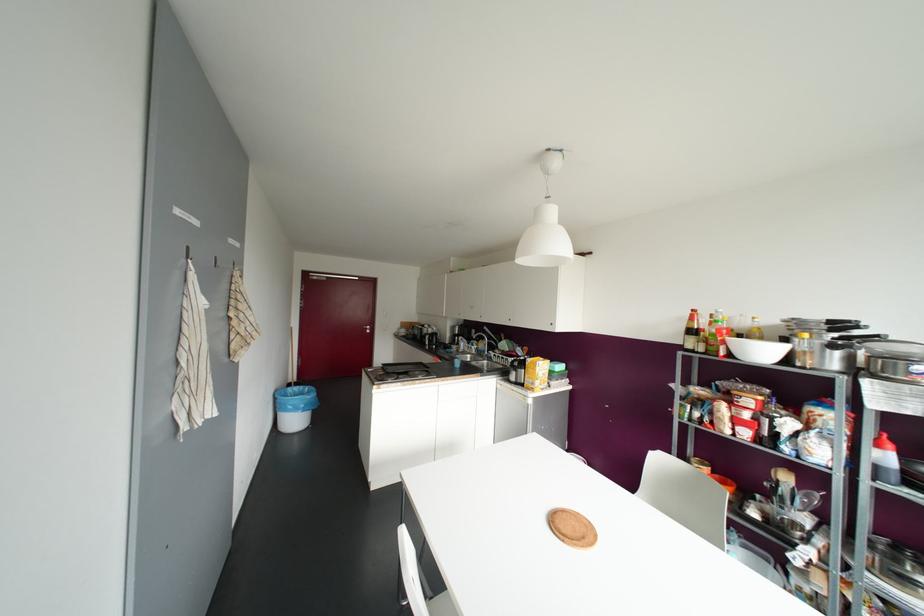
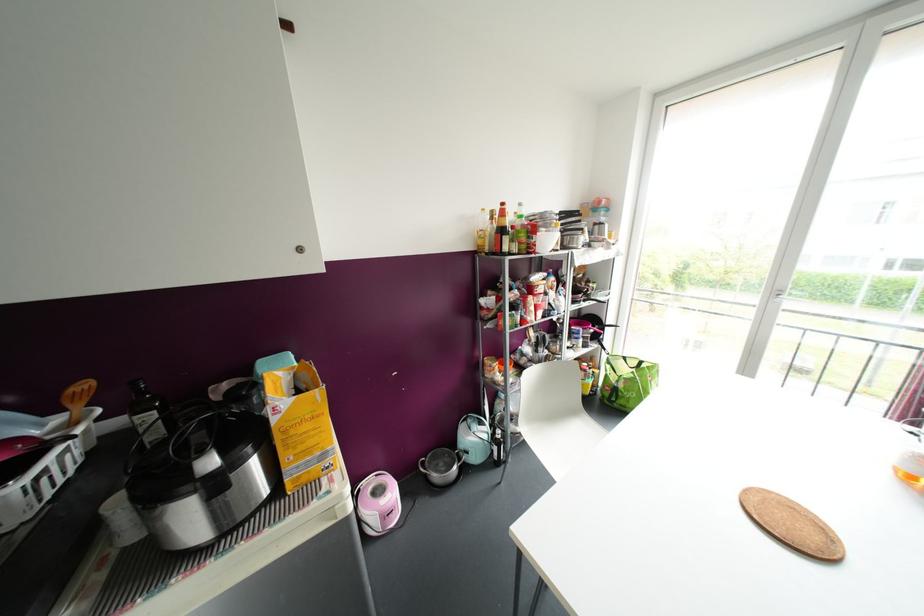
Find the pixel in the second image that matches point 693,310 in the first image.

(502, 204)